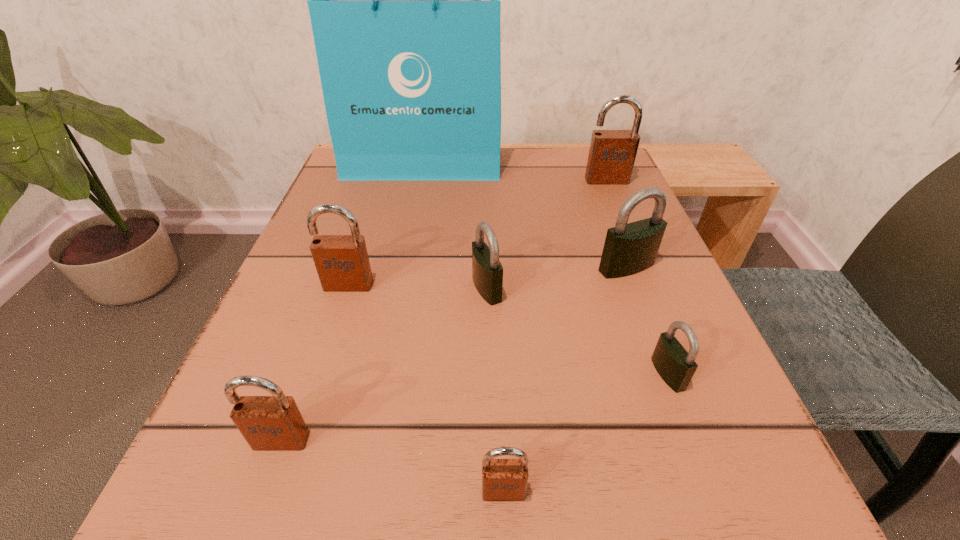
Identify which object is located as the seventh nearest to the nearest black padlock. Please provide its 2D coordinates. Your answer should be formatted as a tuple, i.e. [(x, y)], where the tuple contains the x and y coordinates of a point satisfying the conditions above.

[(404, 0)]

The image size is (960, 540). Identify the location of object that can be found as the second closest to the seventh farthest object. (342, 263).

What are the coordinates of `padlock that is the sixth closest to the biggest black padlock` in the screenshot? It's located at coord(268,423).

Identify which padlock is the fourth closest to the smallest brown padlock. Please provide its 2D coordinates. Your answer should be formatted as a tuple, i.e. [(x, y)], where the tuple contains the x and y coordinates of a point satisfying the conditions above.

[(342, 263)]

Locate which brown padlock is the closest to the second farthest brown padlock. Please provide its 2D coordinates. Your answer should be formatted as a tuple, i.e. [(x, y)], where the tuple contains the x and y coordinates of a point satisfying the conditions above.

[(268, 423)]

I want to click on the closest brown padlock to the second nearest brown padlock, so click(502, 479).

Identify which black padlock is the third nearest to the second tallest object. Please provide its 2D coordinates. Your answer should be formatted as a tuple, i.e. [(x, y)], where the tuple contains the x and y coordinates of a point satisfying the conditions above.

[(676, 366)]

Where is `the second closest black padlock relative to the tallest object`? the second closest black padlock relative to the tallest object is located at coordinates (487, 271).

I want to click on vacant area in the image that satisfies the following two spatial constraints: 1. on the front-facing side of the second smallest black padlock; 2. on the right side of the second biggest brown padlock, so click(348, 288).